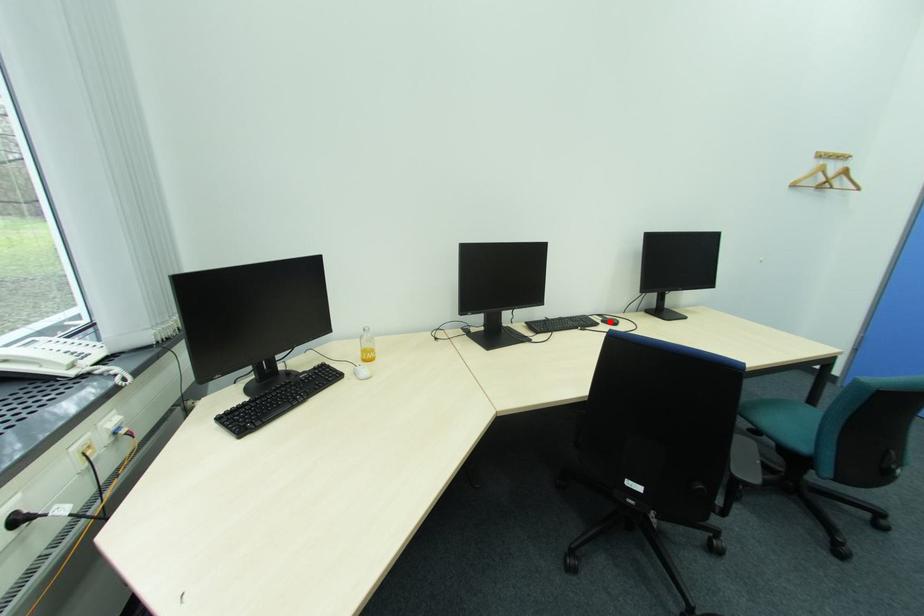
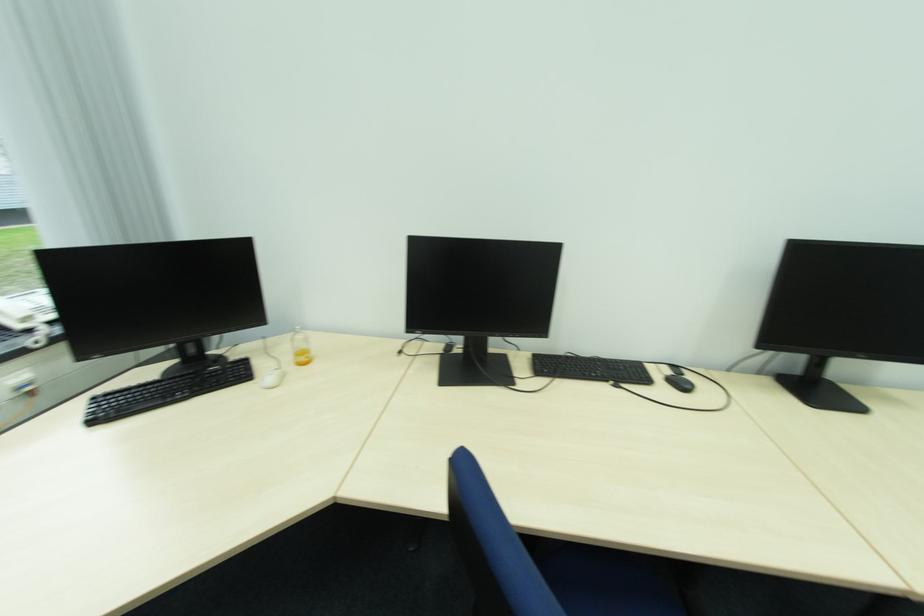
In the second image, find the point that corresponds to the highlighted location in the first image.

(677, 379)